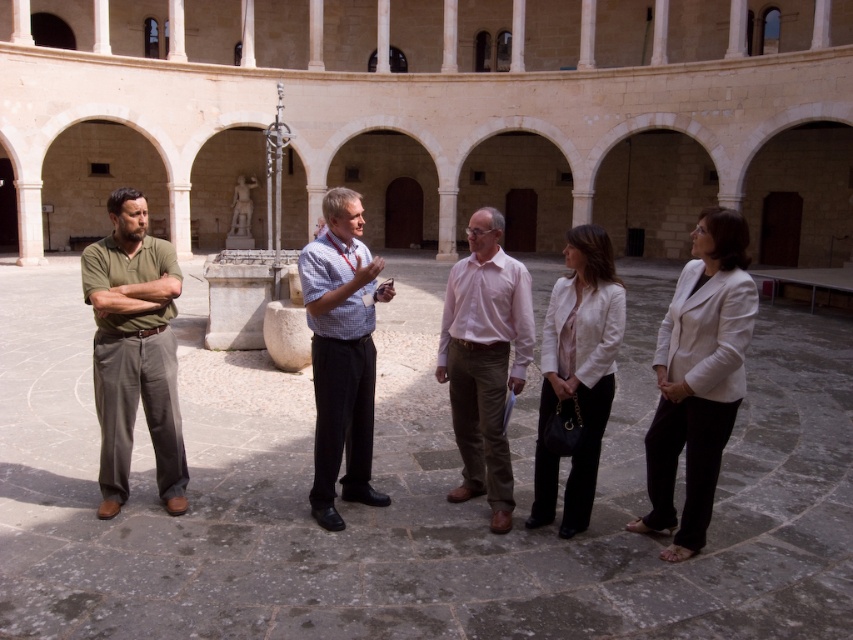
You are standing at point (331, 300) and want to walk to point (154, 388). Is the path between these two points clear of any obstacles?

The path between point (154, 388) and point (331, 300) is clear of any obstacles because the fountain and statue are located in the center of the courtyard, which is not between these two points.

You are standing at the entrance of the courtyard and want to locate the person wearing the matte green shirt at left. According to the coordinates given, where should you look to find them?

The person wearing the matte green shirt at left is located at coordinates point [134,349], which would be to your left side near the entrance area.